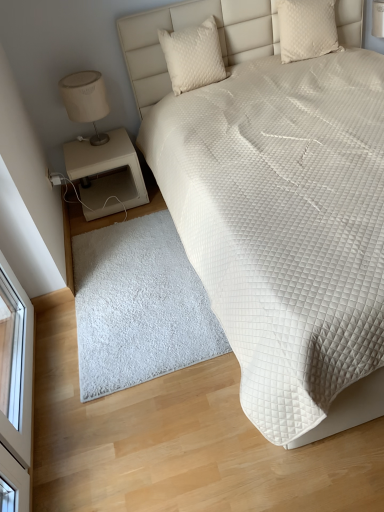
Question: Can you confirm if white quilted pillow at upper right, marked as the 2th pillow in a left-to-right arrangement, is positioned to the left of white quilted bed at upper right?

Choices:
 (A) no
 (B) yes

Answer: (A)

Question: Is white quilted pillow at upper right, arranged as the first pillow when viewed from the right, aimed at white quilted bed at upper right?

Choices:
 (A) no
 (B) yes

Answer: (B)

Question: Are white quilted pillow at upper right, arranged as the first pillow when viewed from the right, and white quilted bed at upper right beside each other?

Choices:
 (A) no
 (B) yes

Answer: (A)

Question: From the image's perspective, is white quilted pillow at upper right, arranged as the first pillow when viewed from the right, on white quilted bed at upper right?

Choices:
 (A) no
 (B) yes

Answer: (B)

Question: Is white quilted pillow at upper right, marked as the 2th pillow in a left-to-right arrangement, not inside white quilted bed at upper right?

Choices:
 (A) no
 (B) yes

Answer: (A)

Question: Is white quilted pillow at upper right, arranged as the first pillow when viewed from the right, closer to camera compared to white quilted bed at upper right?

Choices:
 (A) no
 (B) yes

Answer: (A)

Question: Is the depth of beige matte nightstand at lower left greater than that of white quilted bed at upper right?

Choices:
 (A) yes
 (B) no

Answer: (A)

Question: Can you confirm if beige matte nightstand at lower left is thinner than white quilted bed at upper right?

Choices:
 (A) yes
 (B) no

Answer: (A)

Question: From a real-world perspective, is beige matte nightstand at lower left on white quilted bed at upper right?

Choices:
 (A) no
 (B) yes

Answer: (A)

Question: Can you confirm if beige matte nightstand at lower left is wider than white quilted bed at upper right?

Choices:
 (A) yes
 (B) no

Answer: (B)

Question: From a real-world perspective, is beige matte nightstand at lower left below white quilted bed at upper right?

Choices:
 (A) yes
 (B) no

Answer: (A)

Question: Would you say beige matte nightstand at lower left is a long distance from white quilted bed at upper right?

Choices:
 (A) no
 (B) yes

Answer: (A)

Question: Considering the relative sizes of white quilted bed at upper right and white quilted pillow at upper right, marked as the 2th pillow in a left-to-right arrangement, in the image provided, is white quilted bed at upper right smaller than white quilted pillow at upper right, marked as the 2th pillow in a left-to-right arrangement,?

Choices:
 (A) no
 (B) yes

Answer: (A)